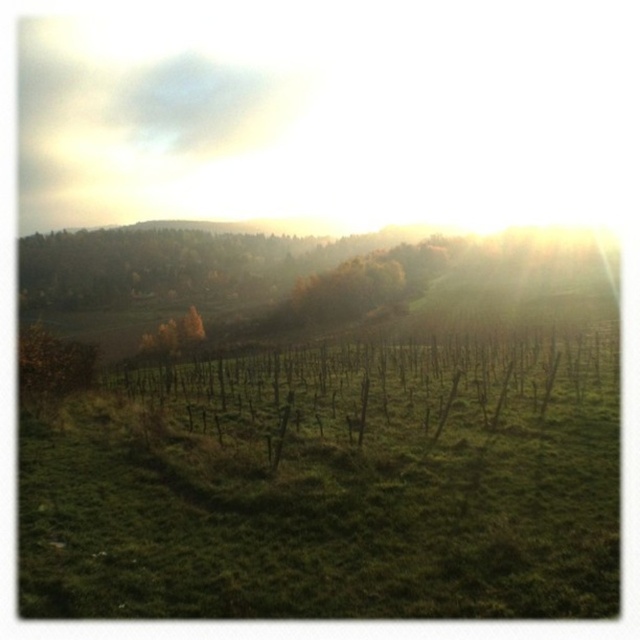
Is green grassy field at center thinner than green leafy tree at left?

Yes.

Does green grassy field at center appear on the left side of green leafy tree at left?

Incorrect, green grassy field at center is not on the left side of green leafy tree at left.

Between point (298, 369) and point (72, 385), which one is positioned behind?

The point (298, 369) is more distant.

Locate an element on the screen. This screenshot has height=640, width=640. green grassy field at center is located at coordinates coord(330,488).

Does green grassy field at center appear on the left side of yellow-green leafy tree at center-left?

Incorrect, green grassy field at center is not on the left side of yellow-green leafy tree at center-left.

Can you confirm if green grassy field at center is taller than yellow-green leafy tree at center-left?

No.

The width and height of the screenshot is (640, 640). I want to click on green grassy field at center, so click(x=330, y=488).

Measure the distance between green leafy tree at left and camera.

green leafy tree at left is 18.28 meters away from camera.

Does green leafy tree at left appear on the left side of yellow-green leafy tree at center-left?

Yes, green leafy tree at left is to the left of yellow-green leafy tree at center-left.

Find the location of a particular element. Image resolution: width=640 pixels, height=640 pixels. green leafy tree at left is located at coordinates (51, 369).